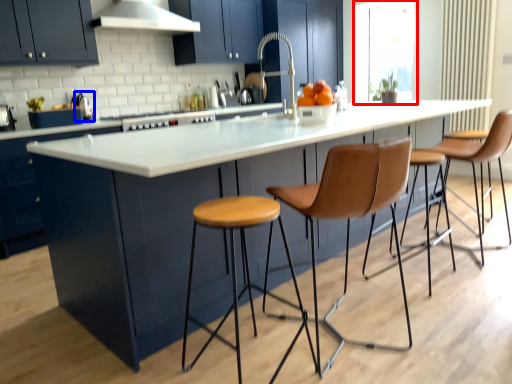
Question: Which object appears closest to the camera in this image, window screen (highlighted by a red box) or appliance (highlighted by a blue box)?

Choices:
 (A) window screen
 (B) appliance

Answer: (B)